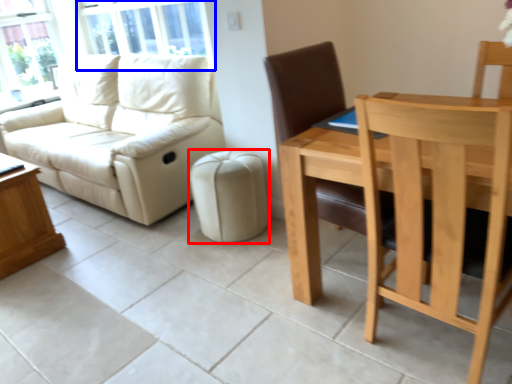
Question: Which object appears farthest to the camera in this image, stool (highlighted by a red box) or window screen (highlighted by a blue box)?

Choices:
 (A) stool
 (B) window screen

Answer: (B)